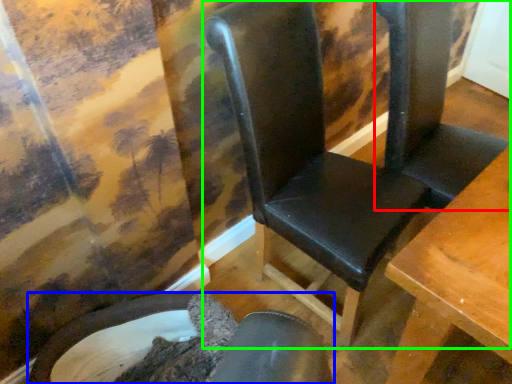
Question: Which object is positioned closest to folding chair (highlighted by a red box)? Select from chair (highlighted by a blue box) and chair (highlighted by a green box).

Choices:
 (A) chair
 (B) chair

Answer: (B)